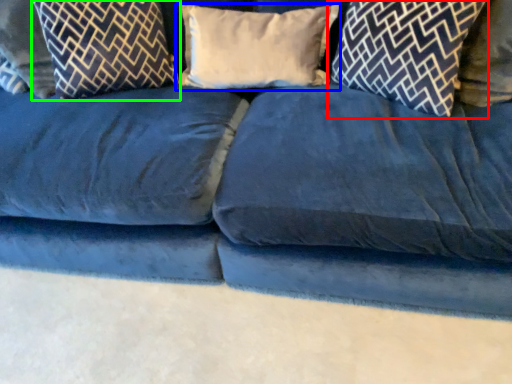
Question: Which object is the farthest from pillow (highlighted by a red box)? Choose among these: pillow (highlighted by a blue box) or pillow (highlighted by a green box).

Choices:
 (A) pillow
 (B) pillow

Answer: (B)